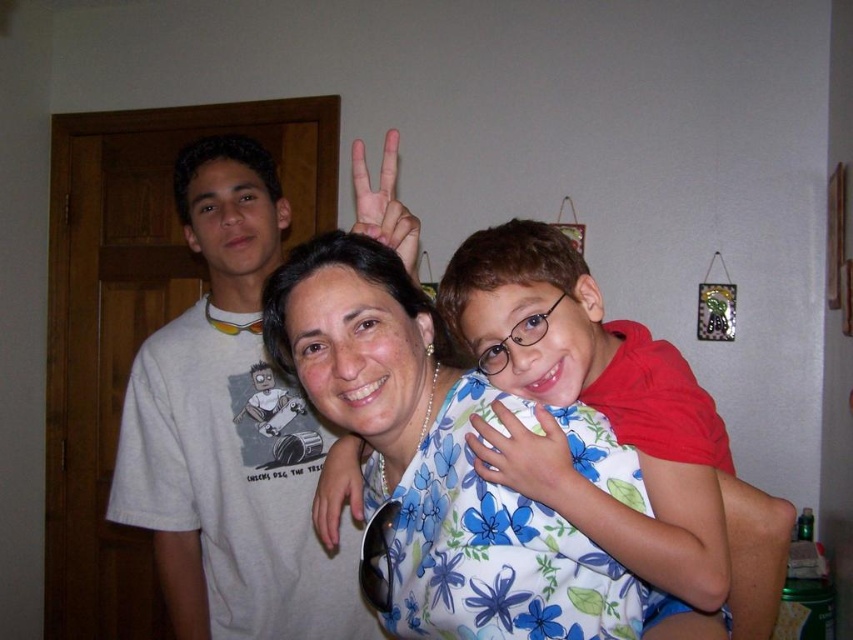
Can you confirm if floral fabric hand at center is bigger than matte skin hand at center?

No, floral fabric hand at center is not bigger than matte skin hand at center.

Who is higher up, floral fabric hand at center or matte skin hand at center?

matte skin hand at center is higher up.

Is point (540, 488) positioned behind point (378, 218)?

No, (540, 488) is closer to viewer.

Locate an element on the screen. Image resolution: width=853 pixels, height=640 pixels. floral fabric hand at center is located at coordinates coord(529,460).

Does floral fabric shirt at center appear under matte black sunglasses at center?

No, floral fabric shirt at center is not below matte black sunglasses at center.

Is floral fabric shirt at center further to camera compared to matte black sunglasses at center?

No, it is in front of matte black sunglasses at center.

Image resolution: width=853 pixels, height=640 pixels. I want to click on floral fabric shirt at center, so click(x=457, y=464).

Is point (183, 628) more distant than point (329, 484)?

Yes.

Between point (253, 212) and point (323, 483), which one is positioned in front?

Positioned in front is point (323, 483).

Describe the element at coordinates (230, 433) in the screenshot. I see `white t-shirt at left` at that location.

Where is `white t-shirt at left`? This screenshot has width=853, height=640. white t-shirt at left is located at coordinates (230, 433).